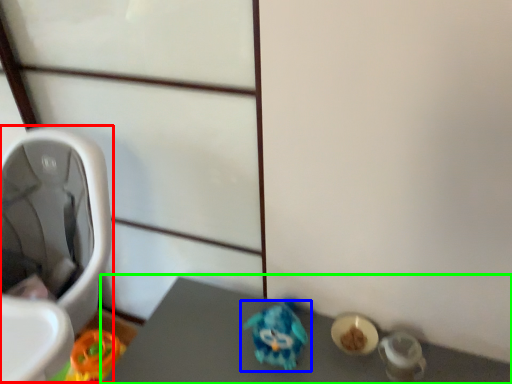
Question: Considering the real-world distances, which object is closest to baby carriage (highlighted by a red box)? toy (highlighted by a blue box) or vanity (highlighted by a green box).

Choices:
 (A) toy
 (B) vanity

Answer: (B)